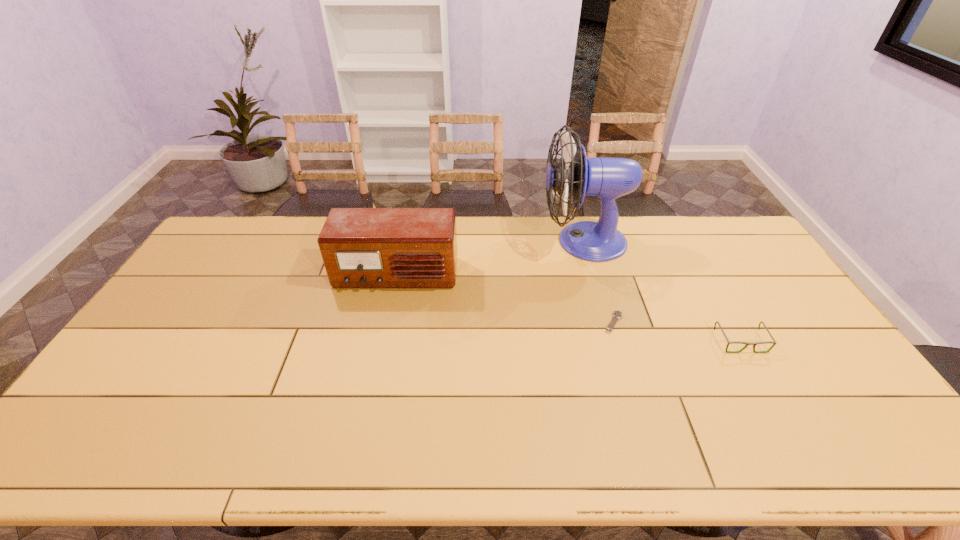
Locate an element on the screen. This screenshot has width=960, height=540. fan is located at coordinates (608, 178).

At what (x,y) coordinates should I click in order to perform the action: click on the third shortest object. Please return your answer as a coordinate pair (x, y). The image size is (960, 540). Looking at the image, I should click on (361, 247).

Identify the location of radio receiver. (361, 247).

Locate an element on the screen. spectacles is located at coordinates (773, 342).

Where is `the rightmost object`? The width and height of the screenshot is (960, 540). the rightmost object is located at coordinates (773, 342).

Find the location of `the shortest object`. the shortest object is located at coordinates (617, 314).

The width and height of the screenshot is (960, 540). What are the coordinates of `free spot located 0.360m in front of the fan where the airflow is directed` in the screenshot? It's located at (442, 241).

What are the coordinates of `free point located in front of the fan where the airflow is directed` in the screenshot? It's located at (483, 241).

In order to click on free spot located in front of the fan where the airflow is directed in this screenshot , I will do `click(431, 241)`.

Locate an element on the screen. The width and height of the screenshot is (960, 540). blank area located on the front-facing side of the radio receiver is located at coordinates (372, 390).